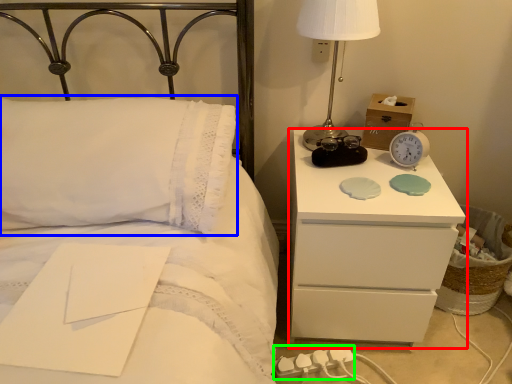
Question: Considering the real-world distances, which object is farthest from nightstand (highlighted by a red box)? pillow (highlighted by a blue box) or charger (highlighted by a green box)?

Choices:
 (A) pillow
 (B) charger

Answer: (A)